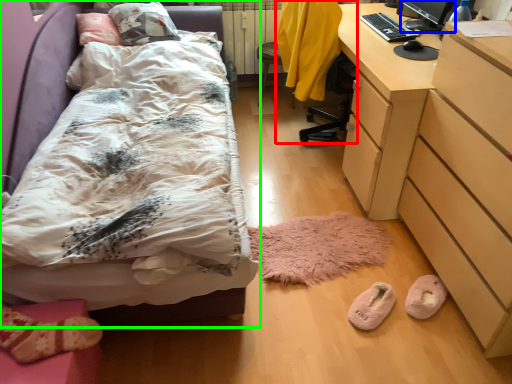
Question: Which is farther away from swivel chair (highlighted by a red box)? computer monitor (highlighted by a blue box) or bed (highlighted by a green box)?

Choices:
 (A) computer monitor
 (B) bed

Answer: (B)